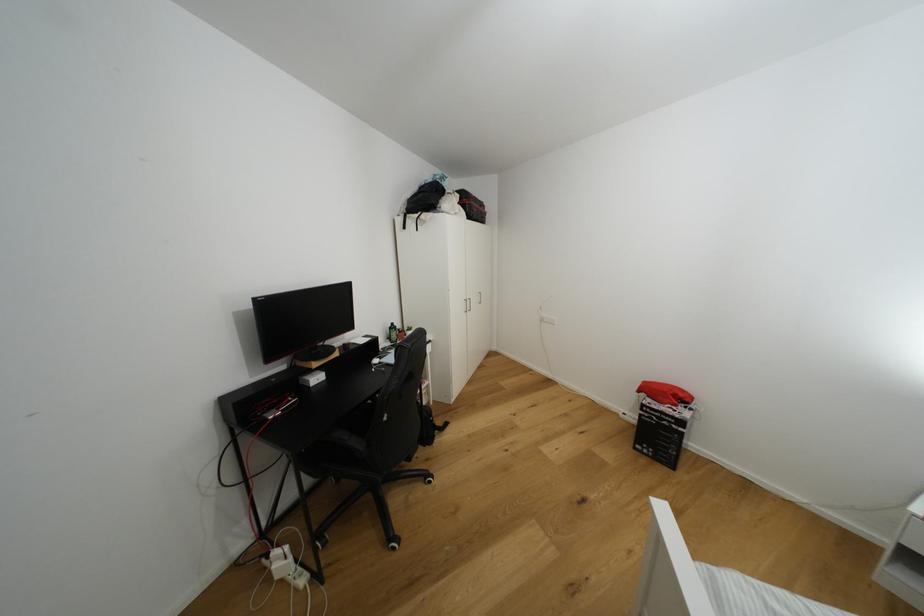
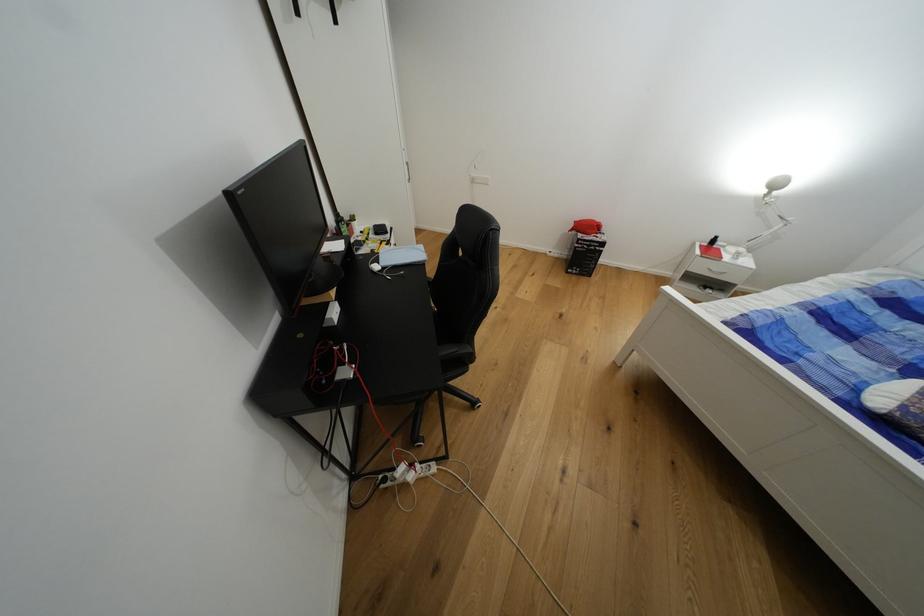
The point at (639, 450) is marked in the first image. Where is the corresponding point in the second image?

(573, 274)